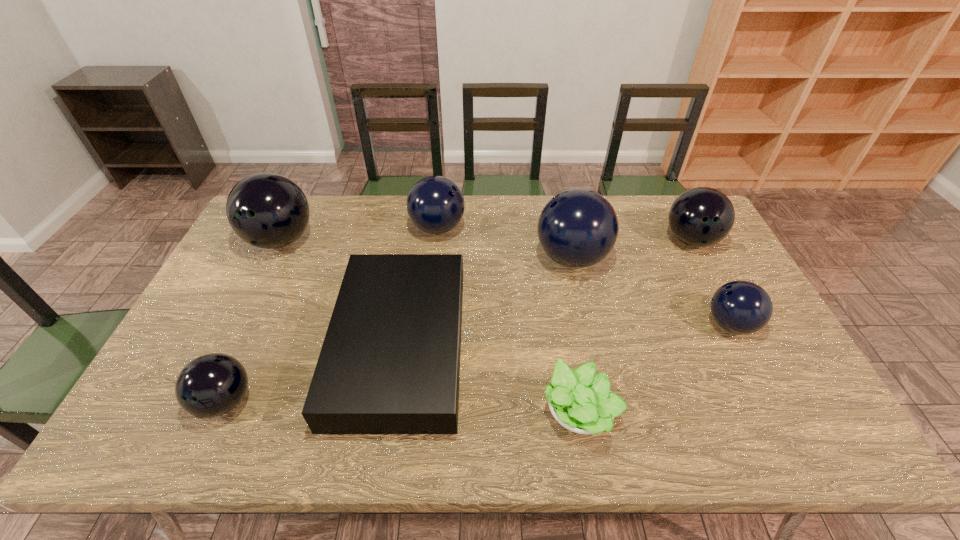
The image size is (960, 540). What are the coordinates of `vacant space located 0.140m on the surface of the rightmost blue bowling ball near the finger holes` in the screenshot? It's located at (654, 325).

Locate an element on the screen. This screenshot has height=540, width=960. vacant region located at the front of the CD player for disc insertion is located at coordinates (510, 346).

The height and width of the screenshot is (540, 960). Find the location of `free point located 0.250m on the right of the lettuce`. free point located 0.250m on the right of the lettuce is located at coordinates (724, 411).

Find the location of a particular element. The height and width of the screenshot is (540, 960). bowling ball present at the near edge is located at coordinates tap(211, 385).

Where is `CD player that is positioned at the near edge`? The height and width of the screenshot is (540, 960). CD player that is positioned at the near edge is located at coordinates (390, 362).

Where is `lettuce present at the near edge`? lettuce present at the near edge is located at coordinates (581, 401).

Locate an element on the screen. object located in the far left corner section of the desktop is located at coordinates (266, 210).

Locate an element on the screen. The height and width of the screenshot is (540, 960). object located at the near left corner is located at coordinates (211, 385).

The height and width of the screenshot is (540, 960). In order to click on object positioned at the far right corner in this screenshot , I will do `click(703, 216)`.

Find the location of a particular element. vacant area at the far edge is located at coordinates (483, 211).